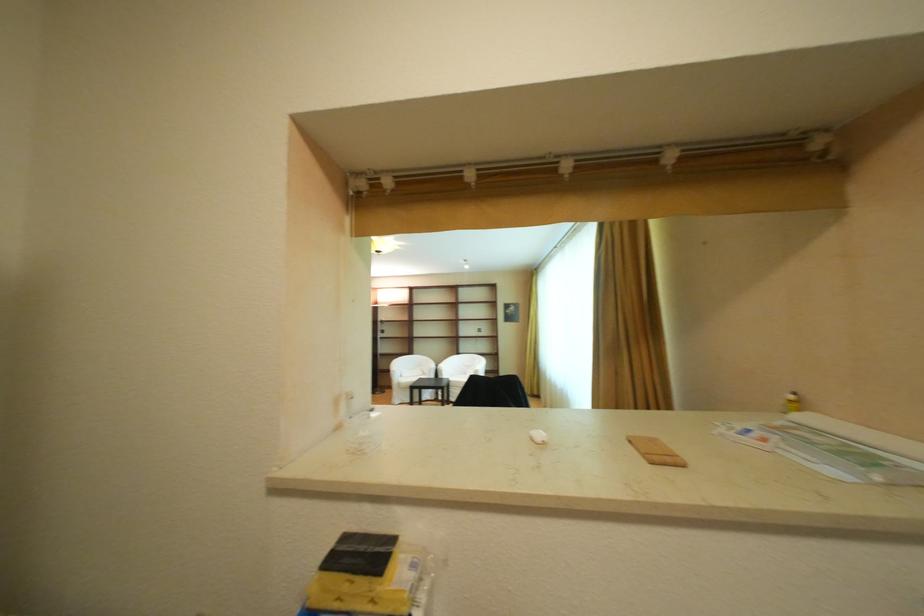
Where would you lift the small yellow bottle? Please return your answer as a coordinate pair (x, y).

(792, 402)